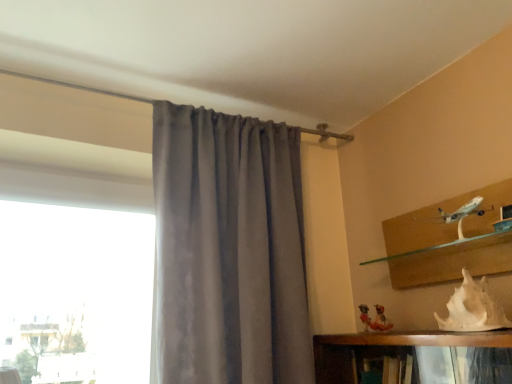
The image size is (512, 384). Identify the location of satin gray curtain at center. (229, 249).

The height and width of the screenshot is (384, 512). Describe the element at coordinates (229, 249) in the screenshot. I see `satin gray curtain at center` at that location.

This screenshot has height=384, width=512. What are the coordinates of `white matte seashell at lower right` in the screenshot? It's located at (473, 308).

Describe the element at coordinates (473, 308) in the screenshot. I see `white matte seashell at lower right` at that location.

This screenshot has height=384, width=512. Find the location of `satin gray curtain at center`. satin gray curtain at center is located at coordinates (229, 249).

In the image, is satin gray curtain at center on the left side or the right side of white matte seashell at lower right?

satin gray curtain at center is to the left of white matte seashell at lower right.

Between satin gray curtain at center and white matte seashell at lower right, which one is positioned in front?

white matte seashell at lower right is more forward.

Which is closer to the camera, (250, 180) or (447, 307)?

A: Point (250, 180) is farther from the camera than point (447, 307).

From the image's perspective, does satin gray curtain at center appear lower than white matte seashell at lower right?

No.

From a real-world perspective, who is located lower, satin gray curtain at center or white matte seashell at lower right?

white matte seashell at lower right.

Is satin gray curtain at center wider or thinner than white matte seashell at lower right?

satin gray curtain at center is wider than white matte seashell at lower right.

Between satin gray curtain at center and white matte seashell at lower right, which one has more height?

With more height is satin gray curtain at center.

Considering the relative sizes of satin gray curtain at center and white matte seashell at lower right in the image provided, is satin gray curtain at center smaller than white matte seashell at lower right?

No, satin gray curtain at center is not smaller than white matte seashell at lower right.

Do you think satin gray curtain at center is within white matte seashell at lower right, or outside of it?

satin gray curtain at center is outside white matte seashell at lower right.

Is satin gray curtain at center far away from white matte seashell at lower right?

No, satin gray curtain at center is not far from white matte seashell at lower right.

Is satin gray curtain at center facing towards white matte seashell at lower right?

Yes, satin gray curtain at center is oriented towards white matte seashell at lower right.

What's the angular difference between satin gray curtain at center and white matte seashell at lower right's facing directions?

86.8 degrees separate the facing orientations of satin gray curtain at center and white matte seashell at lower right.

At what (x,y) coordinates should I click in order to perform the action: click on animal located in front of the satin gray curtain at center. Please return your answer as a coordinate pair (x, y). Looking at the image, I should click on (473, 308).

Visually, is white matte seashell at lower right positioned to the left or to the right of satin gray curtain at center?

Clearly, white matte seashell at lower right is on the right of satin gray curtain at center in the image.

Does white matte seashell at lower right lie behind satin gray curtain at center?

No, it is in front of satin gray curtain at center.

Is point (502, 317) closer to camera compared to point (305, 375)?

Yes, it is in front of point (305, 375).

From the image's perspective, is white matte seashell at lower right above or below satin gray curtain at center?

From the image's perspective, white matte seashell at lower right appears below satin gray curtain at center.

From a real-world perspective, is white matte seashell at lower right physically above satin gray curtain at center?

No, from a real-world perspective, white matte seashell at lower right is not above satin gray curtain at center.

Is white matte seashell at lower right thinner than satin gray curtain at center?

→ Indeed, white matte seashell at lower right has a lesser width compared to satin gray curtain at center.

Does white matte seashell at lower right have a lesser height compared to satin gray curtain at center?

Yes, white matte seashell at lower right is shorter than satin gray curtain at center.

Does white matte seashell at lower right have a smaller size compared to satin gray curtain at center?

Indeed, white matte seashell at lower right has a smaller size compared to satin gray curtain at center.

Is white matte seashell at lower right not within satin gray curtain at center?

That's correct, white matte seashell at lower right is outside of satin gray curtain at center.

Is white matte seashell at lower right in contact with satin gray curtain at center?

No, white matte seashell at lower right is not making contact with satin gray curtain at center.

Is white matte seashell at lower right facing towards satin gray curtain at center?

No, white matte seashell at lower right is not aimed at satin gray curtain at center.

Measure the distance between white matte seashell at lower right and satin gray curtain at center.

They are 29.04 inches apart.

You are a GUI agent. You are given a task and a screenshot of the screen. Output one action in this format:
    pyautogui.click(x=<x>, y=<y>)
    Task: Click on the curtain above the white matte seashell at lower right (from a real-world perspective)
    The image size is (512, 384).
    Given the screenshot: What is the action you would take?
    pyautogui.click(x=229, y=249)

Find the location of `animal to the right of satin gray curtain at center`. animal to the right of satin gray curtain at center is located at coordinates (473, 308).

In the image, there is a satin gray curtain at center. At what (x,y) coordinates should I click in order to perform the action: click on animal below it (from the image's perspective). Please return your answer as a coordinate pair (x, y). This screenshot has height=384, width=512. Looking at the image, I should click on (473, 308).